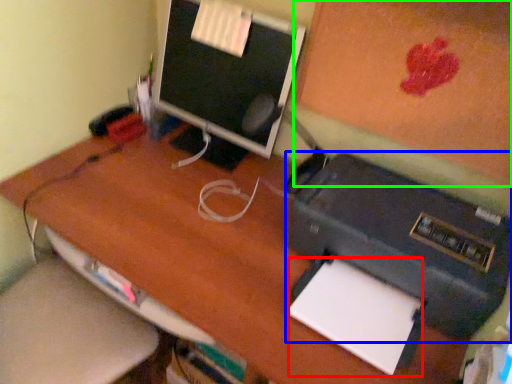
Question: Which object is the closest to the notepad (highlighted by a red box)? Choose among these: printer (highlighted by a blue box) or bulletin board (highlighted by a green box).

Choices:
 (A) printer
 (B) bulletin board

Answer: (A)